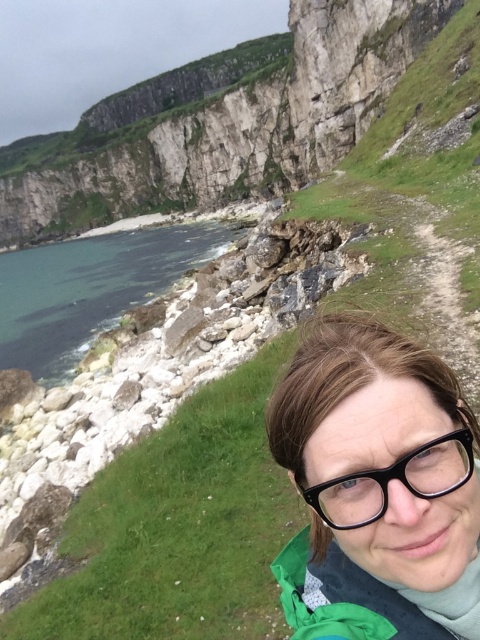
Who is positioned more to the right, smooth rock cliff at upper center or black plastic glasses at center?

From the viewer's perspective, black plastic glasses at center appears more on the right side.

Describe the element at coordinates (245, 124) in the screenshot. I see `smooth rock cliff at upper center` at that location.

The width and height of the screenshot is (480, 640). Find the location of `smooth rock cliff at upper center`. smooth rock cliff at upper center is located at coordinates (245, 124).

Which is behind, point (129, 301) or point (379, 513)?

Positioned behind is point (129, 301).

Measure the distance from greenish water at lower left to black plastic glasses at center.

They are 206.39 feet apart.

Between point (156, 262) and point (472, 458), which one is positioned in front?

Positioned in front is point (472, 458).

The height and width of the screenshot is (640, 480). I want to click on greenish water at lower left, so click(91, 289).

Can you confirm if matte black glasses at lower right is thinner than smooth rock cliff at upper center?

Yes, matte black glasses at lower right is thinner than smooth rock cliff at upper center.

Is matte black glasses at lower right taller than smooth rock cliff at upper center?

No, matte black glasses at lower right is not taller than smooth rock cliff at upper center.

Which is in front, point (305, 458) or point (22, 188)?

Point (305, 458)

The image size is (480, 640). I want to click on matte black glasses at lower right, so [377, 486].